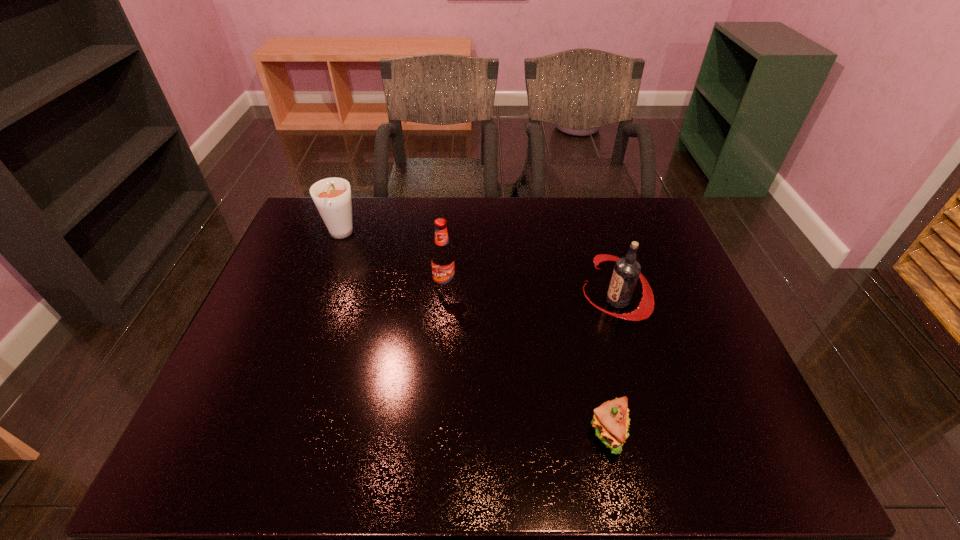
You are a GUI agent. You are given a task and a screenshot of the screen. Output one action in this format:
    pyautogui.click(x=<x>, y=<y>)
    Task: Click on the free spot between the sandwich and the farthest root beer
    
    Given the screenshot: What is the action you would take?
    pyautogui.click(x=474, y=334)

Locate an element on the screen. Image resolution: width=960 pixels, height=540 pixels. empty space between the leftmost root beer and the shortest object is located at coordinates (474, 334).

Choose which object is the second nearest neighbor to the rightmost root beer. Please provide its 2D coordinates. Your answer should be formatted as a tuple, i.e. [(x, y)], where the tuple contains the x and y coordinates of a point satisfying the conditions above.

[(443, 263)]

Identify which object is located as the second nearest to the rightmost root beer. Please provide its 2D coordinates. Your answer should be formatted as a tuple, i.e. [(x, y)], where the tuple contains the x and y coordinates of a point satisfying the conditions above.

[(443, 263)]

Identify which root beer is the second nearest to the second object from left to right. Please provide its 2D coordinates. Your answer should be formatted as a tuple, i.e. [(x, y)], where the tuple contains the x and y coordinates of a point satisfying the conditions above.

[(626, 272)]

This screenshot has width=960, height=540. What are the coordinates of `root beer that stands as the closest to the rightmost root beer` in the screenshot? It's located at (443, 263).

Locate an element on the screen. free location that satisfies the following two spatial constraints: 1. on the drink side of the farthest object; 2. on the right side of the sandwich is located at coordinates (269, 432).

At what (x,y) coordinates should I click in order to perform the action: click on vacant position in the image that satisfies the following two spatial constraints: 1. on the drink side of the nearest object; 2. on the right side of the leftmost root beer. Please return your answer as a coordinate pair (x, y). The height and width of the screenshot is (540, 960). Looking at the image, I should click on tap(269, 432).